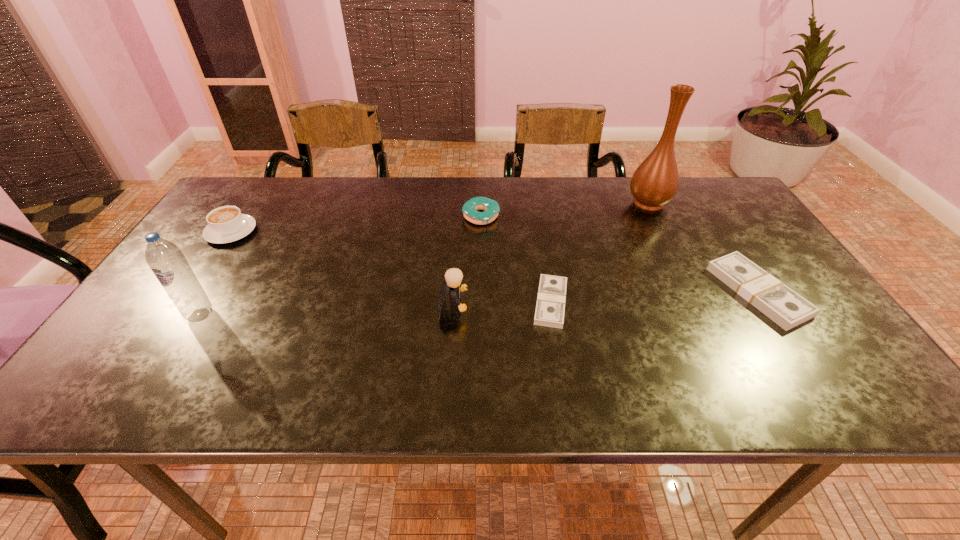
At what (x,y) coordinates should I click in order to perform the action: click on the left dollar. Please return your answer as a coordinate pair (x, y). The width and height of the screenshot is (960, 540). Looking at the image, I should click on (550, 307).

You are a GUI agent. You are given a task and a screenshot of the screen. Output one action in this format:
    pyautogui.click(x=<x>, y=<y>)
    Task: Click on the shortest object
    The width and height of the screenshot is (960, 540).
    Given the screenshot: What is the action you would take?
    pyautogui.click(x=550, y=307)

Identify the location of the taller dollar. This screenshot has height=540, width=960. (781, 304).

You are a GUI agent. You are given a task and a screenshot of the screen. Output one action in this format:
    pyautogui.click(x=<x>, y=<y>)
    Task: Click on the sixth tallest object
    The height and width of the screenshot is (540, 960).
    Given the screenshot: What is the action you would take?
    pyautogui.click(x=781, y=304)

Where is `the fourth tallest object`? This screenshot has height=540, width=960. the fourth tallest object is located at coordinates (226, 224).

Locate an element on the screen. the fifth tallest object is located at coordinates (x=491, y=208).

You are a GUI agent. You are given a task and a screenshot of the screen. Output one action in this format:
    pyautogui.click(x=<x>, y=<y>)
    Task: Click on the vase
    This screenshot has height=540, width=960.
    Given the screenshot: What is the action you would take?
    pyautogui.click(x=655, y=182)

Find the location of a particular element. The image size is (960, 540). the sixth shortest object is located at coordinates (167, 262).

This screenshot has width=960, height=540. I want to click on the third tallest object, so click(453, 277).

This screenshot has height=540, width=960. Identify the location of free space located on the back of the shorter dollar. (539, 227).